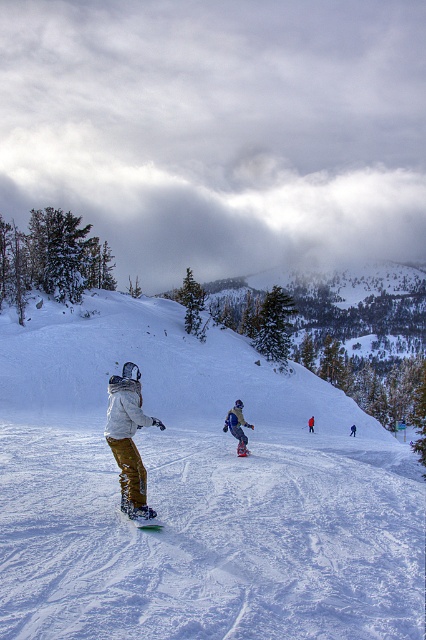
You are a snowboarder trying to locate your green plastic snowboard at center. Based on the coordinates provided, where would you find it in the image?

The green plastic snowboard at center is located at the 2D coordinates point (147, 524) in the image.